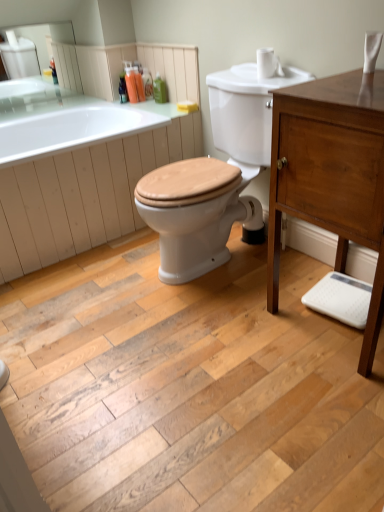
Question: Is translucent plastic bottles at upper center, positioned as the 3th toiletry in right-to-left order, taller or shorter than translucent plastic soap dispenser at upper center, placed as the fourth toiletry when sorted from right to left?

Choices:
 (A) tall
 (B) short

Answer: (B)

Question: Considering the positions of point tap(135, 70) and point tap(135, 89), is point tap(135, 70) closer or farther from the camera than point tap(135, 89)?

Choices:
 (A) closer
 (B) farther

Answer: (B)

Question: Which is farther from the white matte toilet paper at upper right?

Choices:
 (A) translucent plastic soap dispenser at upper center, placed as the fourth toiletry when sorted from right to left
 (B) green plastic bottle at upper center, placed as the 1th toiletry when sorted from right to left
 (C) translucent plastic bottles at upper center, positioned as the 3th toiletry in right-to-left order
 (D) white glossy toilet at center
 (E) matte brown cabinet at right

Answer: (A)

Question: Based on their relative distances, which object is nearer to the white glossy toilet at center?

Choices:
 (A) green plastic bottle at upper center, placed as the 1th toiletry when sorted from right to left
 (B) translucent plastic bottles at upper center, positioned as the 3th toiletry in right-to-left order
 (C) translucent plastic soap dispenser at upper center, which is the 1th toiletry in left-to-right order
 (D) white glossy bathtub at upper left
 (E) translucent plastic soap dispenser at upper center, the 2th toiletry when ordered from right to left

Answer: (D)